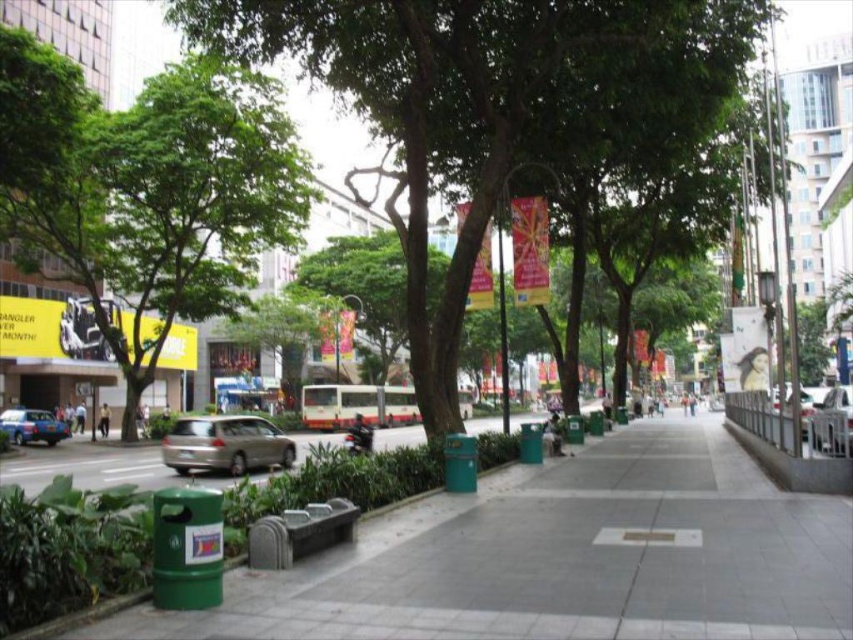
You are a delivery robot navigating the urban street scene. You need to move from your current position to a delivery point located at point (28, 432). However, there is an obstacle at point (815, 417). Will you be able to reach the delivery point without going around the obstacle?

Since point (815, 417) is in front of point (28, 432), the obstacle is blocking the direct path. Therefore, you will need to go around the obstacle to reach the delivery point.